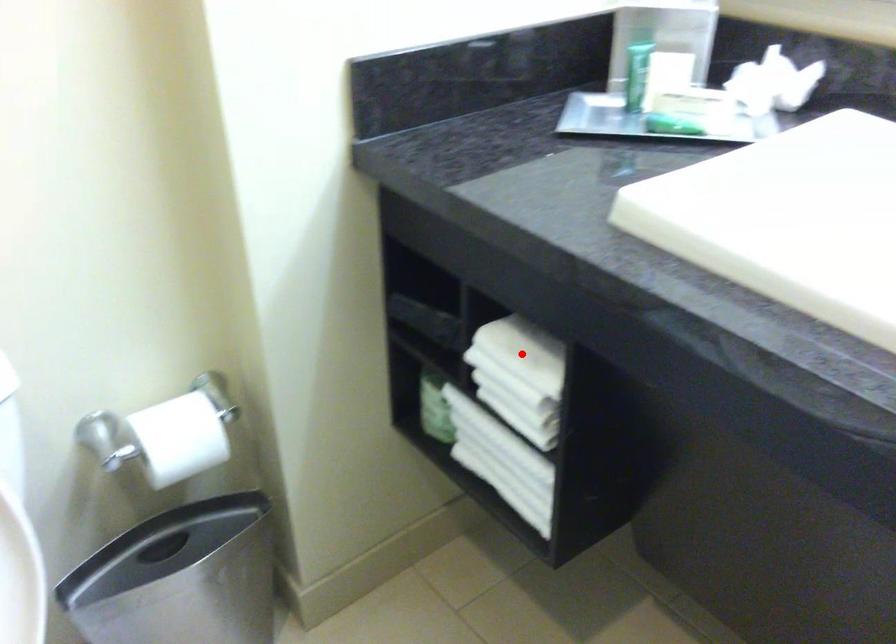
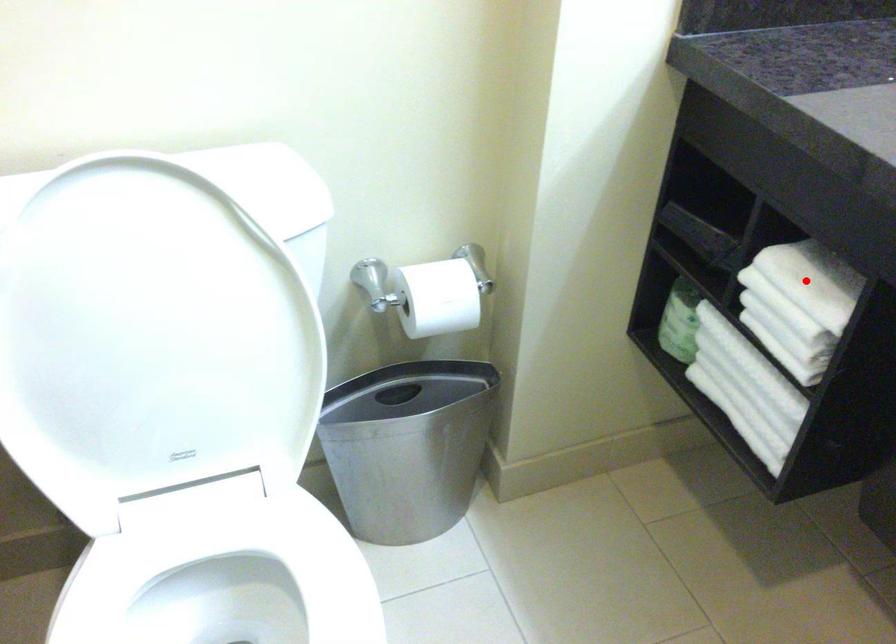
I am providing you with two images of the same scene from different viewpoints. A red point is marked on the first image and another point is marked on the second image. Do the highlighted points in image1 and image2 indicate the same real-world spot?

Yes